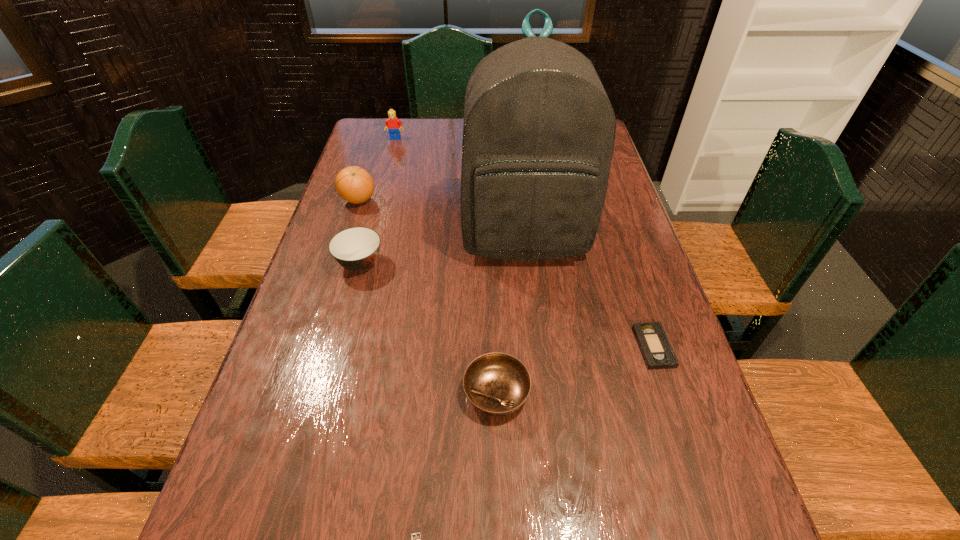
Find the location of `the tallest object`. the tallest object is located at coordinates (538, 134).

The height and width of the screenshot is (540, 960). What are the coordinates of `orange` in the screenshot? It's located at (354, 184).

Locate an element on the screen. This screenshot has height=540, width=960. Lego is located at coordinates (393, 124).

The height and width of the screenshot is (540, 960). I want to click on the left soup bowl, so click(x=356, y=249).

The width and height of the screenshot is (960, 540). Find the location of `the farther soup bowl`. the farther soup bowl is located at coordinates (x=356, y=249).

Locate an element on the screen. The height and width of the screenshot is (540, 960). the nearer soup bowl is located at coordinates (497, 384).

This screenshot has width=960, height=540. Find the location of `the right soup bowl`. the right soup bowl is located at coordinates (497, 384).

At what (x,y) coordinates should I click in order to perform the action: click on videotape. Please return your answer as a coordinate pair (x, y). Image resolution: width=960 pixels, height=540 pixels. Looking at the image, I should click on (653, 342).

This screenshot has width=960, height=540. What are the coordinates of `the second shortest object` in the screenshot? It's located at (653, 342).

This screenshot has height=540, width=960. Find the location of `free spot located on the front-facing side of the backpack`. free spot located on the front-facing side of the backpack is located at coordinates (538, 369).